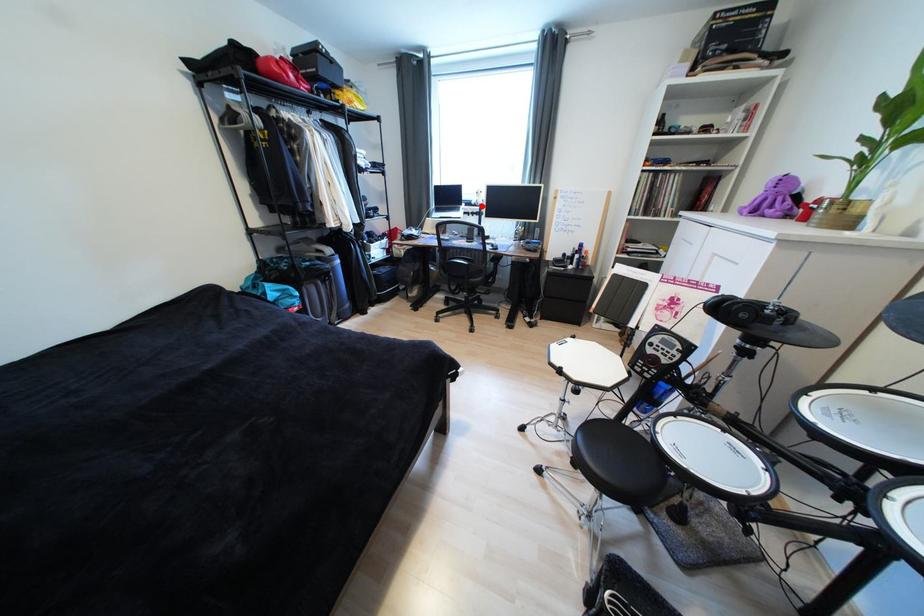
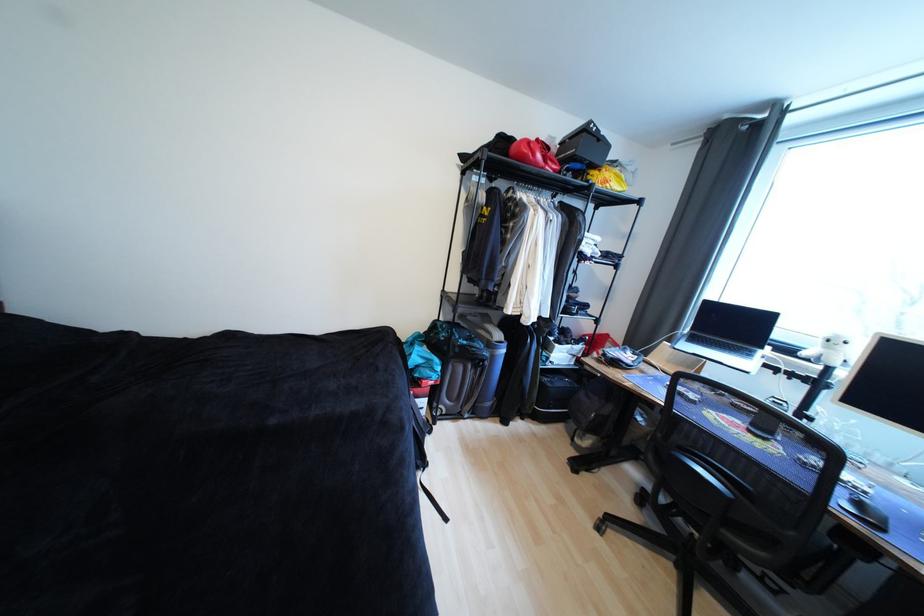
Question: I am providing you with two images of the same scene from different viewpoints. In image1, a red point is highlighted. Considering the same 3D point in image2, which of the following is correct?

Choices:
 (A) It is closer
 (B) It is farther

Answer: (B)